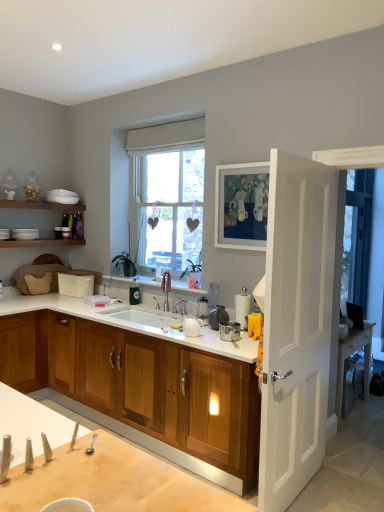
Question: Would you say white matte picture frame at upper center is to the left or to the right of wooden cabinet at center in the picture?

Choices:
 (A) left
 (B) right

Answer: (B)

Question: Considering the positions of point (246, 175) and point (23, 382), is point (246, 175) closer or farther from the camera than point (23, 382)?

Choices:
 (A) farther
 (B) closer

Answer: (B)

Question: Which object is positioned farthest from the white glossy sink at center?

Choices:
 (A) transparent glass door at right
 (B) wooden cabinet at center
 (C) white glossy countertop at center
 (D) white matte picture frame at upper center
 (E) white wooden door at right

Answer: (A)

Question: Considering the real-world distances, which object is farthest from the white glossy sink at center?

Choices:
 (A) wooden cabinet at center
 (B) transparent glass door at right
 (C) white matte picture frame at upper center
 (D) white glossy countertop at center
 (E) white wooden door at right

Answer: (B)